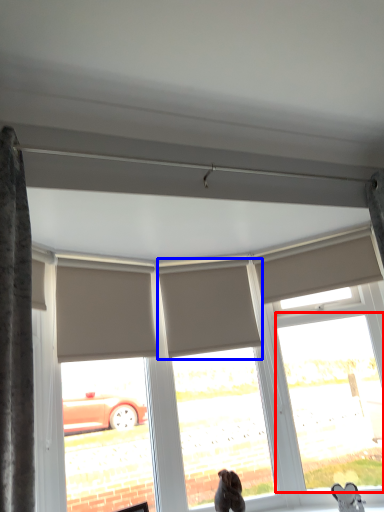
Question: Which of the following is the farthest to the observer, window (highlighted by a red box) or shutter (highlighted by a blue box)?

Choices:
 (A) window
 (B) shutter

Answer: (B)